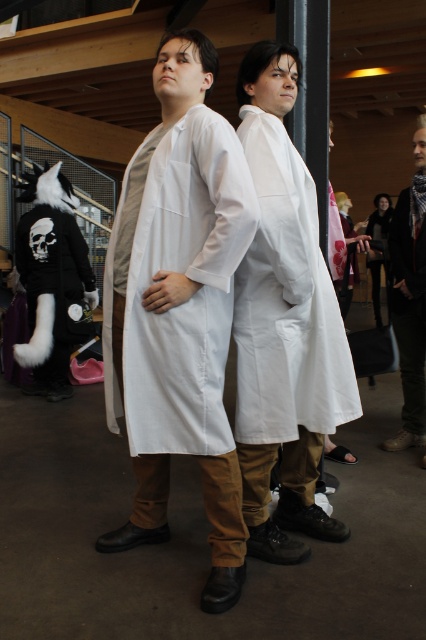
Does white cotton lab coat at center have a larger size compared to white matte lab coat at center?

Yes, white cotton lab coat at center is bigger than white matte lab coat at center.

Measure the distance between white cotton lab coat at center and camera.

white cotton lab coat at center and camera are 1.63 meters apart from each other.

I want to click on white cotton lab coat at center, so click(x=178, y=308).

Can you confirm if dark brown leather jacket at right is positioned above matte black coat at center?

Actually, dark brown leather jacket at right is below matte black coat at center.

Who is taller, dark brown leather jacket at right or matte black coat at center?

dark brown leather jacket at right is taller.

Who is more distant from viewer, (417, 358) or (380, 260)?

Point (380, 260)

Locate an element on the screen. This screenshot has width=426, height=640. dark brown leather jacket at right is located at coordinates (411, 296).

Who is lower down, white matte lab coat at center or dark brown leather jacket at right?

white matte lab coat at center is below.

Who is positioned more to the left, white matte lab coat at center or dark brown leather jacket at right?

white matte lab coat at center

Locate an element on the screen. The height and width of the screenshot is (640, 426). white matte lab coat at center is located at coordinates (284, 323).

Find the location of a particular element. The image size is (426, 640). white matte lab coat at center is located at coordinates (284, 323).